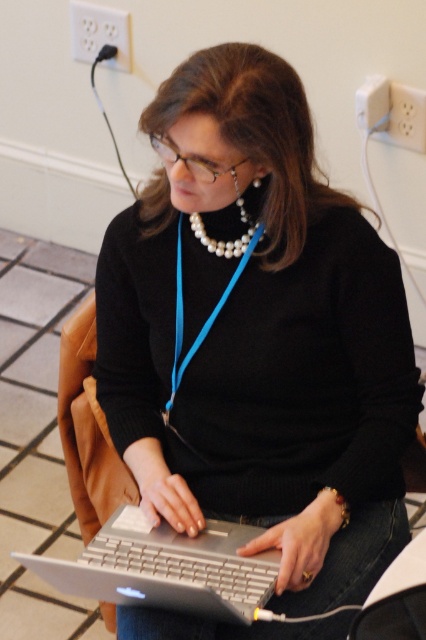
You are a fashion designer observing the woman in the image. You need to determine which accessory at center is wider between the blue fabric lanyard at center and the pearl necklace at center. Which one is wider?

The blue fabric lanyard at center is wider than the pearl necklace at center according to the description.